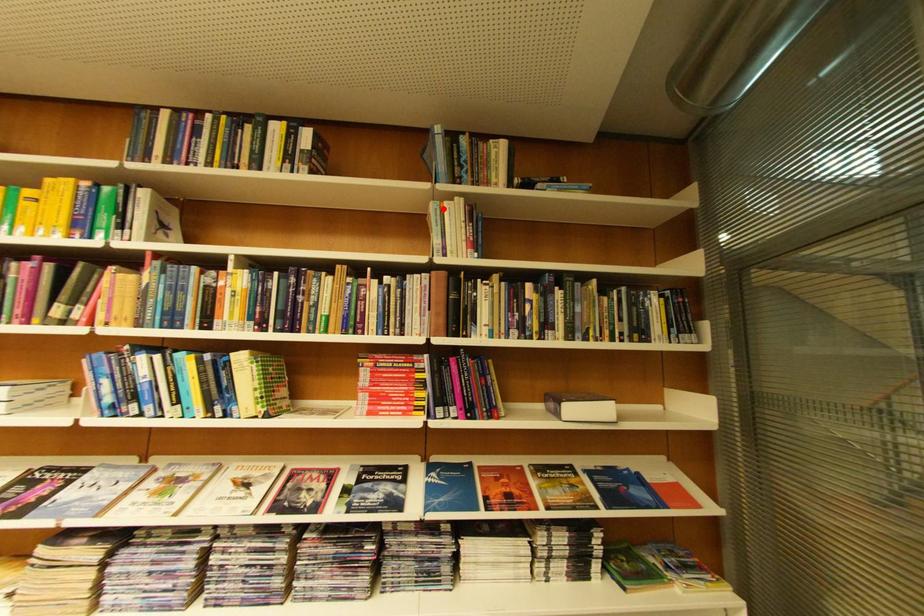
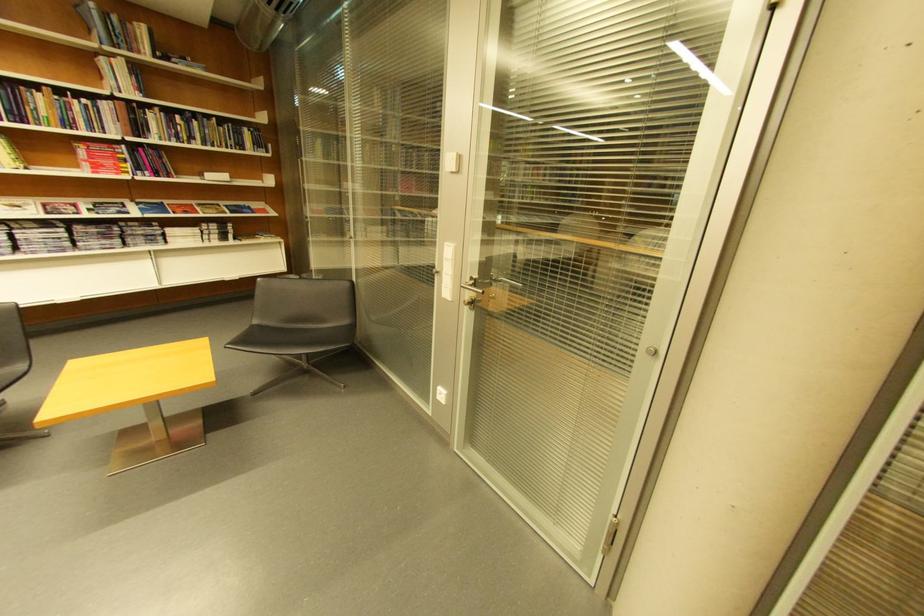
The point at the highlighted location is marked in the first image. Where is the corresponding point in the second image?

(113, 62)